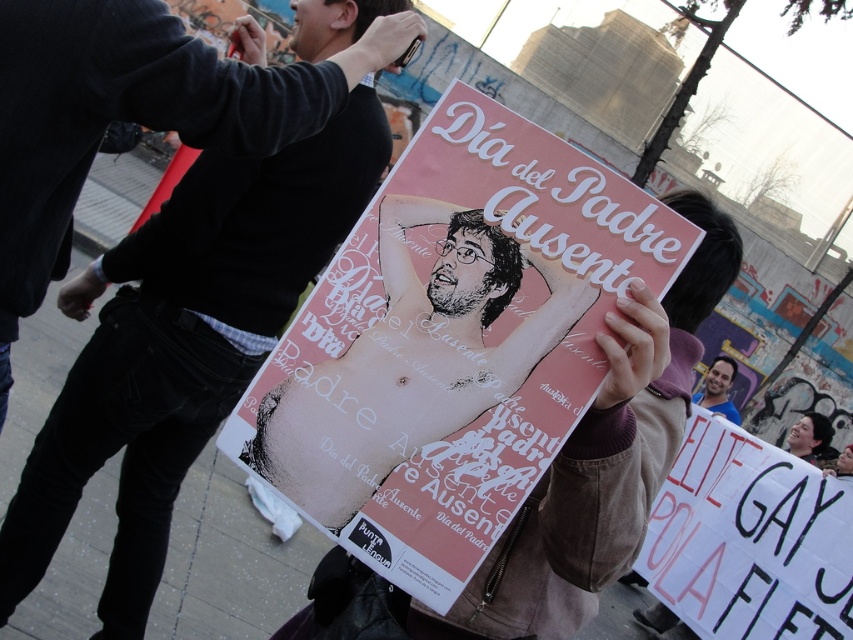
Which is more to the right, pink paper poster at center or matte black poster at center?

pink paper poster at center

Is pink paper poster at center above matte black poster at center?

No, pink paper poster at center is not above matte black poster at center.

Find the location of `pink paper poster at center`. pink paper poster at center is located at coordinates (451, 342).

Can you confirm if matte black poster at center is smaller than white paper sign at lower right?

Incorrect, matte black poster at center is not smaller in size than white paper sign at lower right.

I want to click on matte black poster at center, so click(x=183, y=344).

Between matte pink poster at center and smooth skin face at center, which one is positioned lower?

smooth skin face at center is below.

Is matte pink poster at center positioned behind smooth skin face at center?

That is False.

Is point (340, 413) farther from camera compared to point (714, 369)?

No, (340, 413) is in front of (714, 369).

The height and width of the screenshot is (640, 853). In order to click on matte pink poster at center in this screenshot , I will do `click(410, 362)`.